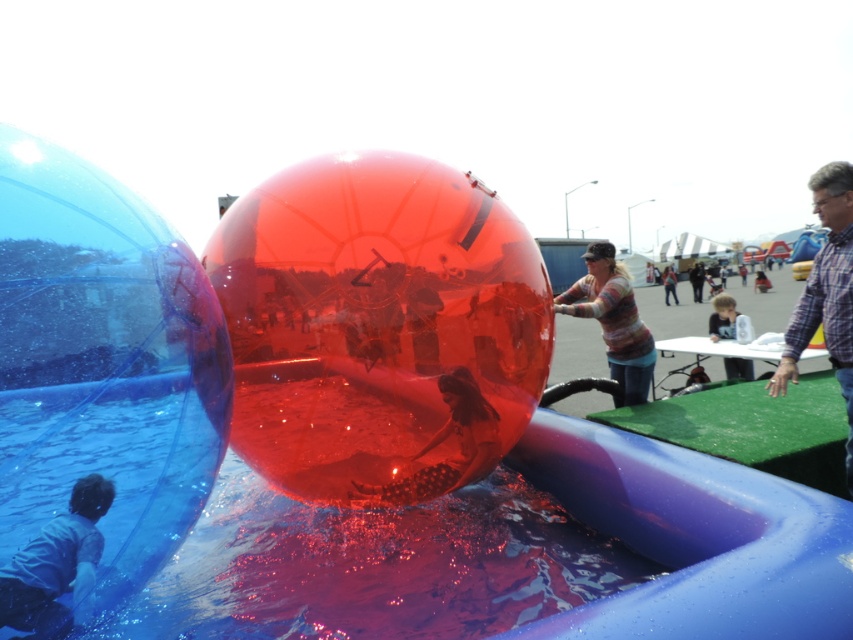
Question: Which object is farther from the camera taking this photo?

Choices:
 (A) striped sweater at center
 (B) transparent plastic ball at center

Answer: (A)

Question: Is transparent plastic ball at center positioned in front of plaid shirt at right?

Choices:
 (A) no
 (B) yes

Answer: (B)

Question: Considering the real-world distances, which object is farthest from the smooth skin child at center?

Choices:
 (A) striped sweater at center
 (B) transparent plastic ball at center
 (C) plaid shirt at right

Answer: (B)

Question: Is transparent plastic ball at center to the left of smooth skin child at center from the viewer's perspective?

Choices:
 (A) yes
 (B) no

Answer: (A)

Question: Is transparent plastic ball at center bigger than striped sweater at center?

Choices:
 (A) yes
 (B) no

Answer: (B)

Question: Among these objects, which one is nearest to the camera?

Choices:
 (A) smooth skin child at center
 (B) transparent plastic ball at center

Answer: (B)